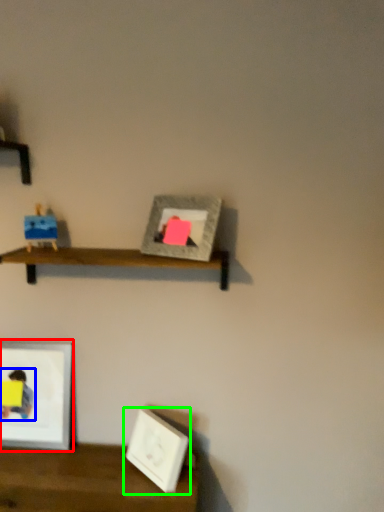
Question: Estimate the real-world distances between objects in this image. Which object is closer to picture frame (highlighted by a red box), person (highlighted by a blue box) or picture frame (highlighted by a green box)?

Choices:
 (A) person
 (B) picture frame

Answer: (A)